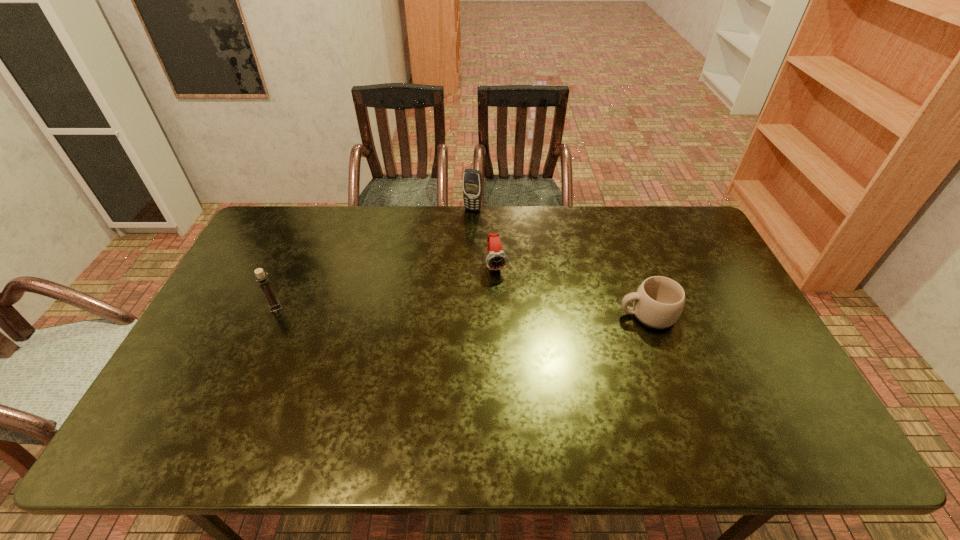
At what (x,y) coordinates should I click in order to perform the action: click on the leftmost object. Please return your answer as a coordinate pair (x, y). Looking at the image, I should click on (274, 305).

The image size is (960, 540). Find the location of `the rightmost object`. the rightmost object is located at coordinates (659, 301).

Find the location of a particular element. The image size is (960, 540). the third object from left to right is located at coordinates (497, 259).

I want to click on watch, so click(497, 259).

Where is `the farthest object`? the farthest object is located at coordinates (472, 179).

At what (x,y) coordinates should I click in order to perform the action: click on cellular telephone. Please return your answer as a coordinate pair (x, y). The image size is (960, 540). Looking at the image, I should click on (472, 179).

Identify the location of free space located 0.200m on the front of the leftmost object. This screenshot has width=960, height=540. (247, 372).

Identify the location of free spot located 0.180m on the side of the rightmost object with the handle. (557, 314).

Where is `vacant area situated 0.270m on the side of the rightmost object with the handle`? vacant area situated 0.270m on the side of the rightmost object with the handle is located at coordinates (526, 314).

At what (x,y) coordinates should I click in order to perform the action: click on blank space located on the side of the rightmost object with the handle. Please return your answer as a coordinate pair (x, y). This screenshot has width=960, height=540. Looking at the image, I should click on (488, 314).